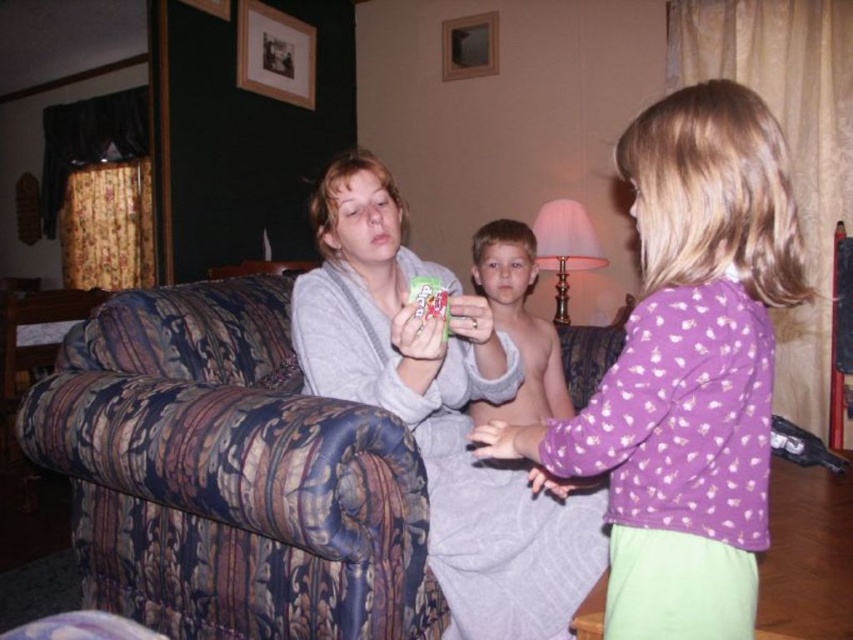
Is purple cotton shirt at center positioned behind smooth skin boy at center?

No.

Looking at this image, which is more to the right, purple cotton shirt at center or smooth skin boy at center?

purple cotton shirt at center is more to the right.

The width and height of the screenshot is (853, 640). What do you see at coordinates (685, 371) in the screenshot?
I see `purple cotton shirt at center` at bounding box center [685, 371].

Where is `purple cotton shirt at center`? This screenshot has height=640, width=853. purple cotton shirt at center is located at coordinates (685, 371).

Which is more to the left, patterned fabric couch at center or smooth skin boy at center?

From the viewer's perspective, patterned fabric couch at center appears more on the left side.

Find the location of a particular element. The height and width of the screenshot is (640, 853). patterned fabric couch at center is located at coordinates (229, 476).

Which is above, gray soft blanket at center or smooth skin boy at center?

smooth skin boy at center is higher up.

Does gray soft blanket at center have a greater height compared to smooth skin boy at center?

Yes.

Who is more distant from viewer, (x=341, y=173) or (x=500, y=262)?

The point (x=500, y=262) is behind.

Identify the location of gray soft blanket at center. (439, 412).